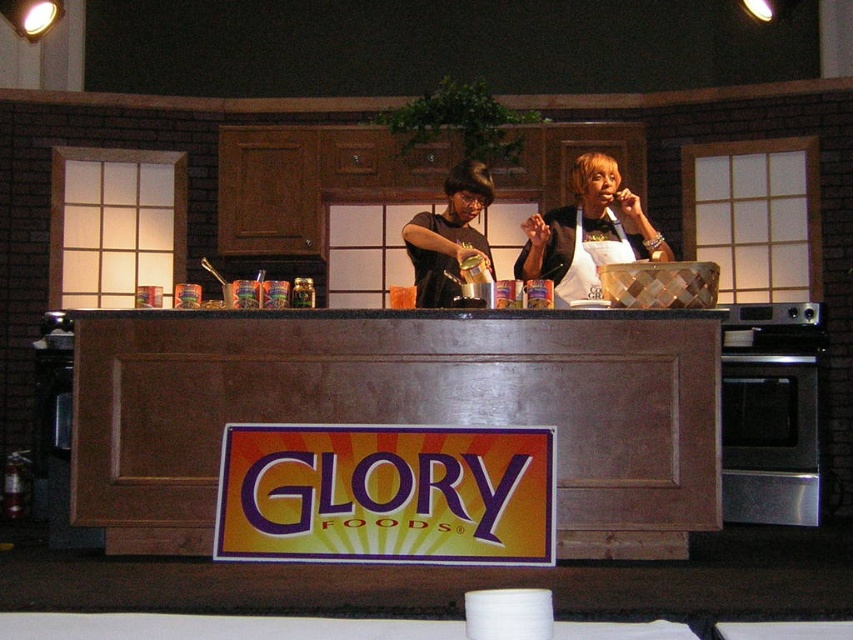
Is yellowmattesign at center in front of white apron at center?

Yes, it is.

Can you confirm if yellowmattesign at center is positioned below white apron at center?

Correct, yellowmattesign at center is located below white apron at center.

Is point (321, 506) less distant than point (618, 193)?

Yes, point (321, 506) is in front of point (618, 193).

You are a GUI agent. You are given a task and a screenshot of the screen. Output one action in this format:
    pyautogui.click(x=<x>, y=<y>)
    Task: Click on the yellowmattesign at center
    This screenshot has width=853, height=640.
    Given the screenshot: What is the action you would take?
    pyautogui.click(x=386, y=493)

Is white apron at center further to camera compared to white fabric apron at center?

No, it is not.

Find the location of `white apron at center`. white apron at center is located at coordinates pos(587,232).

Identify the location of matte black apron at center. The image size is (853, 640). (448, 236).

Which is more to the right, matte black apron at center or white fabric apron at center?

Positioned to the right is white fabric apron at center.

Where is `matte black apron at center`? The height and width of the screenshot is (640, 853). matte black apron at center is located at coordinates (448, 236).

Identify the location of matte black apron at center. The image size is (853, 640). (448, 236).